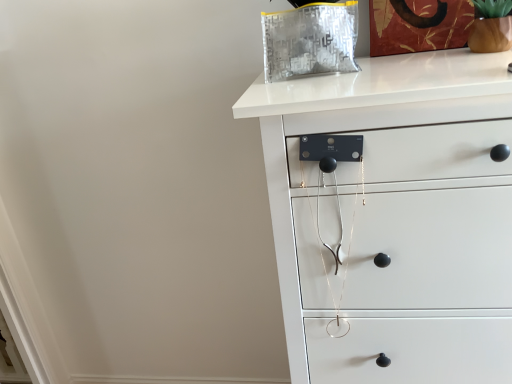
Question: Is white matte chest of drawers at upper right facing away from brown matte glass vase at upper right?

Choices:
 (A) yes
 (B) no

Answer: (B)

Question: Is white matte chest of drawers at upper right behind brown matte glass vase at upper right?

Choices:
 (A) no
 (B) yes

Answer: (A)

Question: Are white matte chest of drawers at upper right and brown matte glass vase at upper right making contact?

Choices:
 (A) no
 (B) yes

Answer: (A)

Question: Is white matte chest of drawers at upper right thinner than brown matte glass vase at upper right?

Choices:
 (A) no
 (B) yes

Answer: (A)

Question: Is white matte chest of drawers at upper right taller than brown matte glass vase at upper right?

Choices:
 (A) no
 (B) yes

Answer: (B)

Question: Does white matte chest of drawers at upper right appear on the left side of brown matte glass vase at upper right?

Choices:
 (A) no
 (B) yes

Answer: (B)

Question: Is brown matte glass vase at upper right positioned with its back to white matte chest of drawers at upper right?

Choices:
 (A) no
 (B) yes

Answer: (A)

Question: From the image's perspective, is brown matte glass vase at upper right beneath white matte chest of drawers at upper right?

Choices:
 (A) yes
 (B) no

Answer: (B)

Question: Is brown matte glass vase at upper right next to white matte chest of drawers at upper right?

Choices:
 (A) yes
 (B) no

Answer: (B)

Question: Can you confirm if brown matte glass vase at upper right is wider than white matte chest of drawers at upper right?

Choices:
 (A) no
 (B) yes

Answer: (A)

Question: From a real-world perspective, is brown matte glass vase at upper right physically above white matte chest of drawers at upper right?

Choices:
 (A) no
 (B) yes

Answer: (B)

Question: Would you say brown matte glass vase at upper right is a long distance from white matte chest of drawers at upper right?

Choices:
 (A) no
 (B) yes

Answer: (A)

Question: From a real-world perspective, is brown matte glass vase at upper right above or below white matte chest of drawers at upper right?

Choices:
 (A) below
 (B) above

Answer: (B)